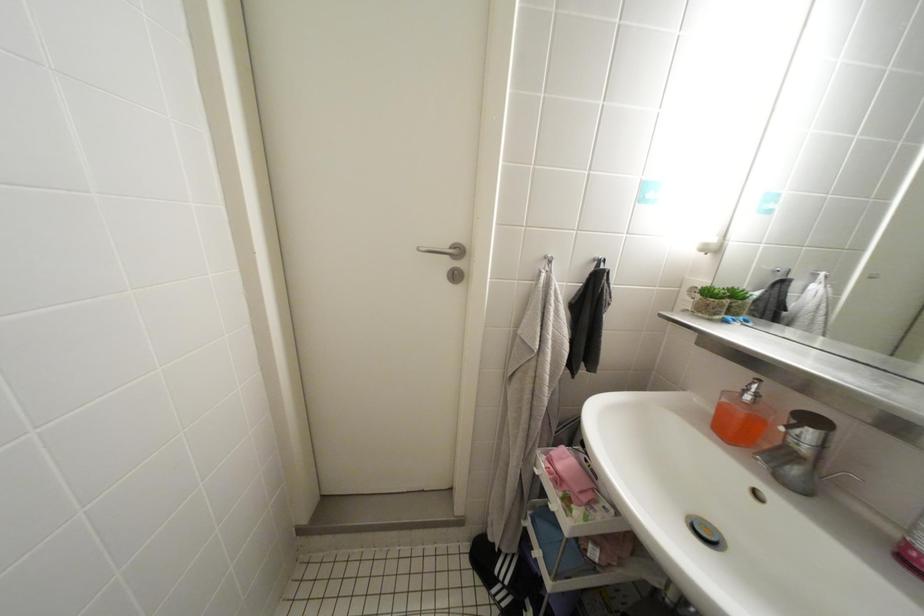
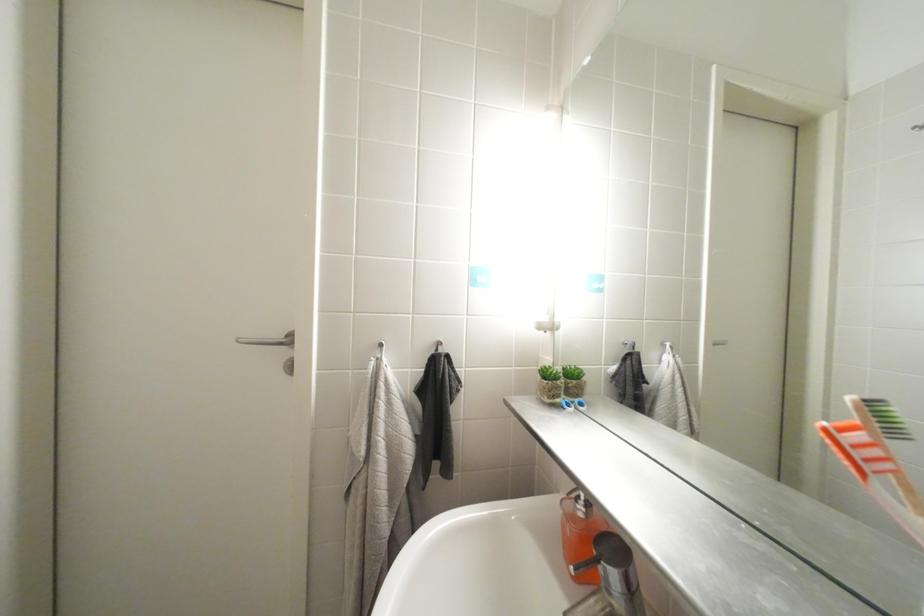
Question: The images are taken continuously from a first-person perspective. In which direction are you moving?

Choices:
 (A) Left
 (B) Right
 (C) Forward
 (D) Backward

Answer: (B)